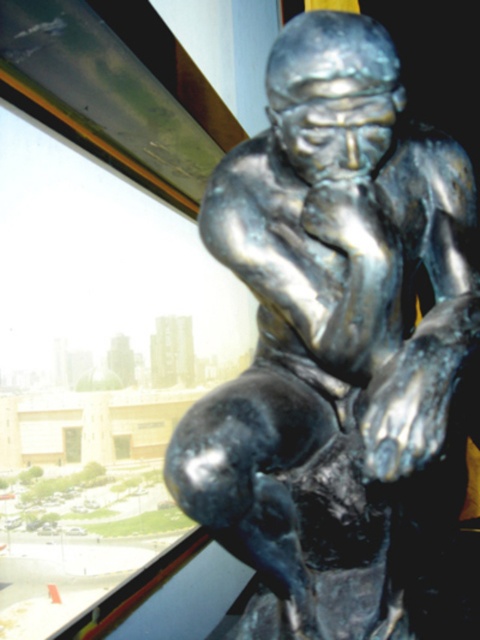
You are standing in front of the metallic sculpture and notice two points marked on the ground. The first point is at coordinates point [262,186] and the second is at point [121,449]. Which point is closer to you?

Point [262,186] is in front of point [121,449], so it is closer to you.

You are standing in a museum gallery and want to take a photo of the bronze statue at center without the transparent glass window at lower left reflecting in the statue. Which side should you position yourself relative to the window to avoid reflections?

To avoid reflections from the transparent glass window at lower left, position yourself on the opposite side of the window from the bronze statue at center. Since the bronze statue at center is on the right side of the window, standing to the left of the window would place the light source behind you, reducing reflections on the statue.